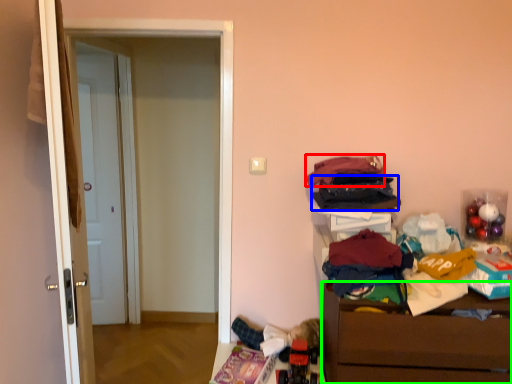
Question: Which object is positioned farthest from clothing (highlighted by a red box)? Select from clothing (highlighted by a blue box) and chest of drawers (highlighted by a green box).

Choices:
 (A) clothing
 (B) chest of drawers

Answer: (B)